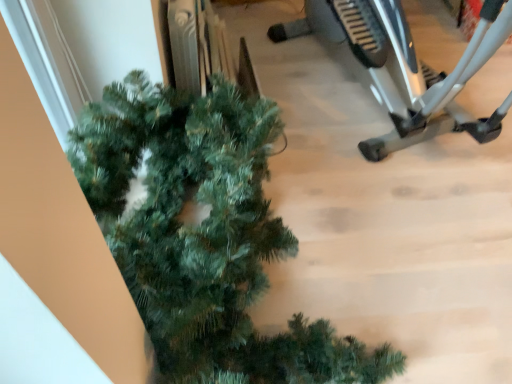
Identify the location of silver metallic stationary bicycle at right. This screenshot has height=384, width=512. (404, 67).

Describe the element at coordinates (404, 67) in the screenshot. This screenshot has width=512, height=384. I see `silver metallic stationary bicycle at right` at that location.

I want to click on green matte christmas tree at lower left, so pyautogui.click(x=204, y=235).

Describe the element at coordinates (204, 235) in the screenshot. The width and height of the screenshot is (512, 384). I see `green matte christmas tree at lower left` at that location.

Where is `silver metallic stationary bicycle at right`? The height and width of the screenshot is (384, 512). silver metallic stationary bicycle at right is located at coordinates (404, 67).

Can you confirm if green matte christmas tree at lower left is positioned to the right of silver metallic stationary bicycle at right?

In fact, green matte christmas tree at lower left is to the left of silver metallic stationary bicycle at right.

Is green matte christmas tree at lower left behind silver metallic stationary bicycle at right?

No, it is in front of silver metallic stationary bicycle at right.

Is point (237, 330) closer or farther from the camera than point (404, 144)?

Point (237, 330) is positioned closer to the camera compared to point (404, 144).

From the image's perspective, is green matte christmas tree at lower left beneath silver metallic stationary bicycle at right?

Indeed, from the image's perspective, green matte christmas tree at lower left is shown beneath silver metallic stationary bicycle at right.

From a real-world perspective, is green matte christmas tree at lower left physically located above or below silver metallic stationary bicycle at right?

Clearly, from a real-world perspective, green matte christmas tree at lower left is below silver metallic stationary bicycle at right.

Can you confirm if green matte christmas tree at lower left is thinner than silver metallic stationary bicycle at right?

Yes, green matte christmas tree at lower left is thinner than silver metallic stationary bicycle at right.

From their relative heights in the image, would you say green matte christmas tree at lower left is taller or shorter than silver metallic stationary bicycle at right?

green matte christmas tree at lower left is shorter than silver metallic stationary bicycle at right.

Based on their sizes in the image, would you say green matte christmas tree at lower left is bigger or smaller than silver metallic stationary bicycle at right?

Clearly, green matte christmas tree at lower left is smaller in size than silver metallic stationary bicycle at right.

Looking at this image, can silver metallic stationary bicycle at right be found inside green matte christmas tree at lower left?

Result: No, silver metallic stationary bicycle at right is not surrounded by green matte christmas tree at lower left.

Is green matte christmas tree at lower left not near silver metallic stationary bicycle at right?

green matte christmas tree at lower left is positioned a significant distance from silver metallic stationary bicycle at right.

Is green matte christmas tree at lower left aimed at silver metallic stationary bicycle at right?

No, green matte christmas tree at lower left is not turned towards silver metallic stationary bicycle at right.

How different are the orientations of green matte christmas tree at lower left and silver metallic stationary bicycle at right in degrees?

The angular difference between green matte christmas tree at lower left and silver metallic stationary bicycle at right is 71.9 degrees.

Measure the distance from green matte christmas tree at lower left to silver metallic stationary bicycle at right.

green matte christmas tree at lower left is 1.01 meters away from silver metallic stationary bicycle at right.

Where is `stationary bicycle behind the green matte christmas tree at lower left`? This screenshot has width=512, height=384. stationary bicycle behind the green matte christmas tree at lower left is located at coordinates (404, 67).

Which object is positioned more to the left, silver metallic stationary bicycle at right or green matte christmas tree at lower left?

green matte christmas tree at lower left.

Which object is closer to the camera, silver metallic stationary bicycle at right or green matte christmas tree at lower left?

green matte christmas tree at lower left is closer to the camera.

Considering the positions of point (330, 19) and point (236, 155), is point (330, 19) closer or farther from the camera than point (236, 155)?

Point (330, 19) is positioned farther from the camera compared to point (236, 155).

From the image's perspective, which one is positioned lower, silver metallic stationary bicycle at right or green matte christmas tree at lower left?

green matte christmas tree at lower left, from the image's perspective.

From a real-world perspective, is silver metallic stationary bicycle at right below green matte christmas tree at lower left?

Incorrect, from a real-world perspective, silver metallic stationary bicycle at right is higher than green matte christmas tree at lower left.

Which object is wider, silver metallic stationary bicycle at right or green matte christmas tree at lower left?

Wider between the two is silver metallic stationary bicycle at right.

Considering the relative sizes of silver metallic stationary bicycle at right and green matte christmas tree at lower left in the image provided, is silver metallic stationary bicycle at right taller than green matte christmas tree at lower left?

Indeed, silver metallic stationary bicycle at right has a greater height compared to green matte christmas tree at lower left.

Can you confirm if silver metallic stationary bicycle at right is bigger than green matte christmas tree at lower left?

Correct, silver metallic stationary bicycle at right is larger in size than green matte christmas tree at lower left.

Is silver metallic stationary bicycle at right positioned beyond the bounds of green matte christmas tree at lower left?

Indeed, silver metallic stationary bicycle at right is completely outside green matte christmas tree at lower left.

Is silver metallic stationary bicycle at right directly adjacent to green matte christmas tree at lower left?

No, silver metallic stationary bicycle at right is not next to green matte christmas tree at lower left.

Is silver metallic stationary bicycle at right aimed at green matte christmas tree at lower left?

No.

Locate an element on the screen. The image size is (512, 384). stationary bicycle located on the right of green matte christmas tree at lower left is located at coordinates click(x=404, y=67).

The image size is (512, 384). Identify the location of christmas tree below the silver metallic stationary bicycle at right (from a real-world perspective). (204, 235).

Where is `stationary bicycle above the green matte christmas tree at lower left (from the image's perspective)`? The image size is (512, 384). stationary bicycle above the green matte christmas tree at lower left (from the image's perspective) is located at coordinates [404, 67].